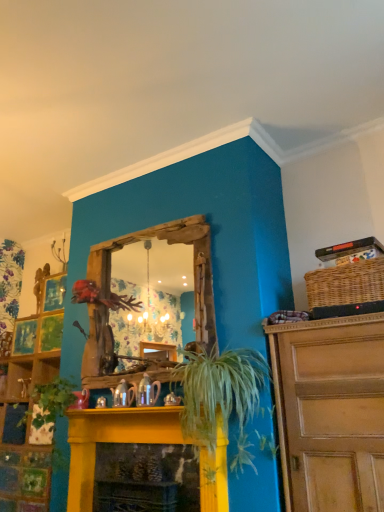
Question: Can you confirm if woven brown basket at upper right is thinner than green matte plant at lower left?

Choices:
 (A) no
 (B) yes

Answer: (B)

Question: Can you confirm if woven brown basket at upper right is shorter than green matte plant at lower left?

Choices:
 (A) no
 (B) yes

Answer: (B)

Question: Considering the relative positions of woven brown basket at upper right and green matte plant at lower left in the image provided, is woven brown basket at upper right in front of green matte plant at lower left?

Choices:
 (A) yes
 (B) no

Answer: (A)

Question: Is woven brown basket at upper right bigger than green matte plant at lower left?

Choices:
 (A) yes
 (B) no

Answer: (B)

Question: Can green matte plant at lower left be found inside woven brown basket at upper right?

Choices:
 (A) no
 (B) yes

Answer: (A)

Question: Considering the relative sizes of woven brown basket at upper right and green matte plant at lower left in the image provided, is woven brown basket at upper right taller than green matte plant at lower left?

Choices:
 (A) yes
 (B) no

Answer: (B)

Question: Is green matte plant at lower left positioned before green leafy plant at center?

Choices:
 (A) no
 (B) yes

Answer: (A)

Question: Is green matte plant at lower left to the left of green leafy plant at center from the viewer's perspective?

Choices:
 (A) yes
 (B) no

Answer: (A)

Question: Does green matte plant at lower left appear on the right side of green leafy plant at center?

Choices:
 (A) yes
 (B) no

Answer: (B)

Question: Is green matte plant at lower left further to camera compared to green leafy plant at center?

Choices:
 (A) yes
 (B) no

Answer: (A)

Question: Is green matte plant at lower left not inside green leafy plant at center?

Choices:
 (A) no
 (B) yes

Answer: (B)

Question: From the image's perspective, is green matte plant at lower left on top of green leafy plant at center?

Choices:
 (A) no
 (B) yes

Answer: (A)

Question: Is the position of yellow painted wood fireplace at center less distant than that of green matte plant at lower left?

Choices:
 (A) yes
 (B) no

Answer: (A)